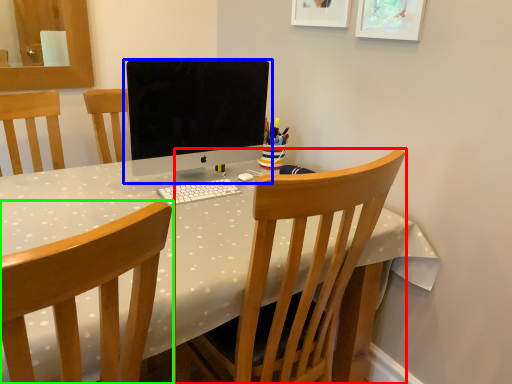
Question: Estimate the real-world distances between objects in this image. Which object is farther from chair (highlighted by a red box), computer monitor (highlighted by a blue box) or chair (highlighted by a green box)?

Choices:
 (A) computer monitor
 (B) chair

Answer: (A)